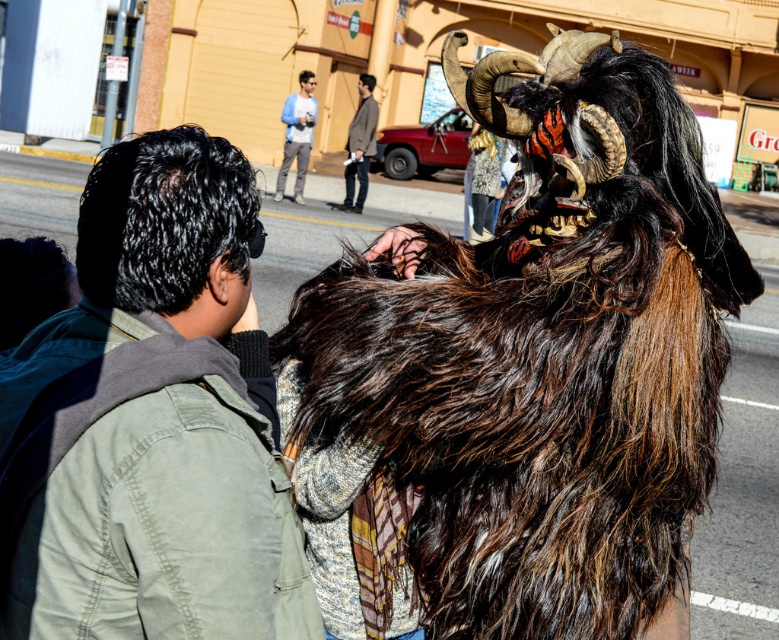
How far apart are green fabric jacket at center and blue denim jeans at upper center?

They are 19.66 meters apart.

What do you see at coordinates (147, 420) in the screenshot? I see `green fabric jacket at center` at bounding box center [147, 420].

Locate an element on the screen. green fabric jacket at center is located at coordinates (147, 420).

Is point (177, 385) positioned after point (368, 148)?

No, (177, 385) is in front of (368, 148).

Measure the distance between green fabric jacket at center and light brown leather jacket at center.

green fabric jacket at center and light brown leather jacket at center are 18.65 meters apart.

Describe the element at coordinates (147, 420) in the screenshot. The width and height of the screenshot is (779, 640). I see `green fabric jacket at center` at that location.

Locate an element on the screen. The height and width of the screenshot is (640, 779). green fabric jacket at center is located at coordinates (147, 420).

Looking at this image, does furry brown mask at center appear under light brown leather jacket at center?

Indeed, furry brown mask at center is positioned under light brown leather jacket at center.

Between point (333, 620) and point (347, 177), which one is positioned behind?

The point (347, 177) is behind.

Locate an element on the screen. The image size is (779, 640). furry brown mask at center is located at coordinates (x=523, y=372).